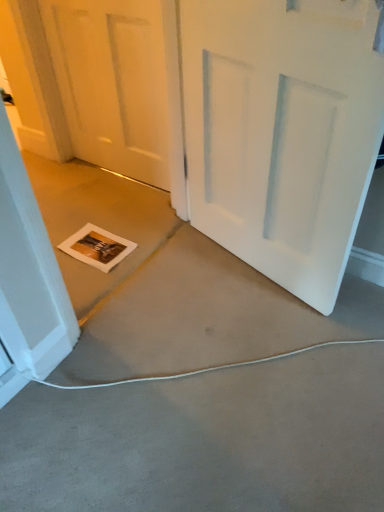
At what (x,y) coordinates should I click in order to perform the action: click on white matte door at center, acting as the 2th door starting from the right. Please return your answer as a coordinate pair (x, y). Looking at the image, I should click on (112, 83).

What do you see at coordinates (205, 440) in the screenshot? The image size is (384, 512). I see `gray carpet at lower center` at bounding box center [205, 440].

Identify the location of white matte door at center, acting as the 2th door starting from the right. (112, 83).

You are a GUI agent. You are given a task and a screenshot of the screen. Output one action in this format:
    pyautogui.click(x=<x>, y=<y>)
    Task: Click on the door that is the 1st one when counting upward from the gray carpet at lower center (from the image's perspective)
    Image resolution: width=384 pixels, height=512 pixels.
    Given the screenshot: What is the action you would take?
    point(282,132)

Does white matte door at center, which ranks as the 1th door in right-to-left order, come behind gray carpet at lower center?

Yes, it is.

Between white matte door at center, which ranks as the 1th door in right-to-left order, and gray carpet at lower center, which one appears on the left side from the viewer's perspective?

gray carpet at lower center.

From a real-world perspective, is white matte door at center, the second door positioned from the left, positioned over gray carpet at lower center based on gravity?

Yes, from a real-world perspective, white matte door at center, the second door positioned from the left, is above gray carpet at lower center.

Is white matte door at center, which is the 1th door in left-to-right order, beside gray carpet at lower center?

No, white matte door at center, which is the 1th door in left-to-right order, is not next to gray carpet at lower center.

From a real-world perspective, is white matte door at center, which is the 1th door in left-to-right order, physically located above or below gray carpet at lower center?

From a real-world perspective, white matte door at center, which is the 1th door in left-to-right order, is physically above gray carpet at lower center.

Is white matte door at center, acting as the 2th door starting from the right, not inside gray carpet at lower center?

white matte door at center, acting as the 2th door starting from the right, lies outside gray carpet at lower center's area.

Is white matte door at center, which is the 1th door in left-to-right order, thinner than white matte door at center, which ranks as the 1th door in right-to-left order?

Yes.

How different are the orientations of white matte door at center, which is the 1th door in left-to-right order, and white matte door at center, which ranks as the 1th door in right-to-left order, in degrees?

The facing directions of white matte door at center, which is the 1th door in left-to-right order, and white matte door at center, which ranks as the 1th door in right-to-left order, are 15.4 degrees apart.

Can you confirm if white matte door at center, acting as the 2th door starting from the right, is positioned to the left of white matte door at center, which ranks as the 1th door in right-to-left order?

Indeed, white matte door at center, acting as the 2th door starting from the right, is positioned on the left side of white matte door at center, which ranks as the 1th door in right-to-left order.

Is white matte door at center, which ranks as the 1th door in right-to-left order, aimed at white matte door at center, acting as the 2th door starting from the right?

No, white matte door at center, which ranks as the 1th door in right-to-left order, is not facing towards white matte door at center, acting as the 2th door starting from the right.

Looking at this image, is white matte door at center, the second door positioned from the left, positioned far away from white matte door at center, acting as the 2th door starting from the right?

No, white matte door at center, the second door positioned from the left, is not far away from white matte door at center, acting as the 2th door starting from the right.

Do you think white matte door at center, which ranks as the 1th door in right-to-left order, is within white matte door at center, acting as the 2th door starting from the right, or outside of it?

white matte door at center, which ranks as the 1th door in right-to-left order, cannot be found inside white matte door at center, acting as the 2th door starting from the right.

Is gray carpet at lower center aimed at white matte door at center, acting as the 2th door starting from the right?

No.

Looking at this image, from the image's perspective, relative to white matte door at center, which is the 1th door in left-to-right order, is gray carpet at lower center above or below?

gray carpet at lower center is situated lower than white matte door at center, which is the 1th door in left-to-right order, in the image.

Does gray carpet at lower center come behind white matte door at center, which is the 1th door in left-to-right order?

No, gray carpet at lower center is closer to the camera.

Is gray carpet at lower center positioned with its back to white matte door at center, the second door positioned from the left?

gray carpet at lower center is not turned away from white matte door at center, the second door positioned from the left.

Does point (172, 252) appear closer or farther from the camera than point (350, 64)?

Point (172, 252) is farther from the camera than point (350, 64).

How many degrees apart are the facing directions of gray carpet at lower center and white matte door at center, which ranks as the 1th door in right-to-left order?

There is a 73.6-degree angle between the facing directions of gray carpet at lower center and white matte door at center, which ranks as the 1th door in right-to-left order.

Which object is closer to the camera, gray carpet at lower center or white matte door at center, the second door positioned from the left?

gray carpet at lower center.

The width and height of the screenshot is (384, 512). There is a gray carpet at lower center. Find the location of `the 1st door above it (from the image's perspective)`. the 1st door above it (from the image's perspective) is located at coordinates (282, 132).

Locate an element on the screen. This screenshot has width=384, height=512. concrete in front of the white matte door at center, which is the 1th door in left-to-right order is located at coordinates (205, 440).

Looking at the image, which one is located closer to white matte door at center, the second door positioned from the left, white matte door at center, acting as the 2th door starting from the right, or gray carpet at lower center?

gray carpet at lower center lies closer to white matte door at center, the second door positioned from the left, than the other object.

Which object lies nearer to the anchor point white matte door at center, which is the 1th door in left-to-right order, gray carpet at lower center or white matte door at center, the second door positioned from the left?

The object closer to white matte door at center, which is the 1th door in left-to-right order, is white matte door at center, the second door positioned from the left.

When comparing their distances from white matte door at center, which is the 1th door in left-to-right order, does white matte door at center, the second door positioned from the left, or gray carpet at lower center seem closer?

white matte door at center, the second door positioned from the left.

When comparing their distances from gray carpet at lower center, does white matte door at center, which is the 1th door in left-to-right order, or white matte door at center, the second door positioned from the left, seem further?

The object further to gray carpet at lower center is white matte door at center, which is the 1th door in left-to-right order.

Based on their spatial positions, is gray carpet at lower center or white matte door at center, acting as the 2th door starting from the right, closer to white matte door at center, which ranks as the 1th door in right-to-left order?

Based on the image, gray carpet at lower center appears to be nearer to white matte door at center, which ranks as the 1th door in right-to-left order.

From the image, which object appears to be farther from gray carpet at lower center, white matte door at center, the second door positioned from the left, or white matte door at center, which is the 1th door in left-to-right order?

Among the two, white matte door at center, which is the 1th door in left-to-right order, is located further to gray carpet at lower center.

What are the coordinates of `door that lies between white matte door at center, which is the 1th door in left-to-right order, and gray carpet at lower center from top to bottom` in the screenshot? It's located at (282, 132).